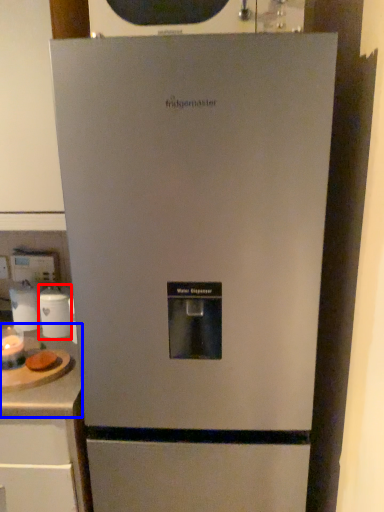
Question: Which point is further to the camera, appliance (highlighted by a red box) or counter top (highlighted by a blue box)?

Choices:
 (A) appliance
 (B) counter top

Answer: (A)